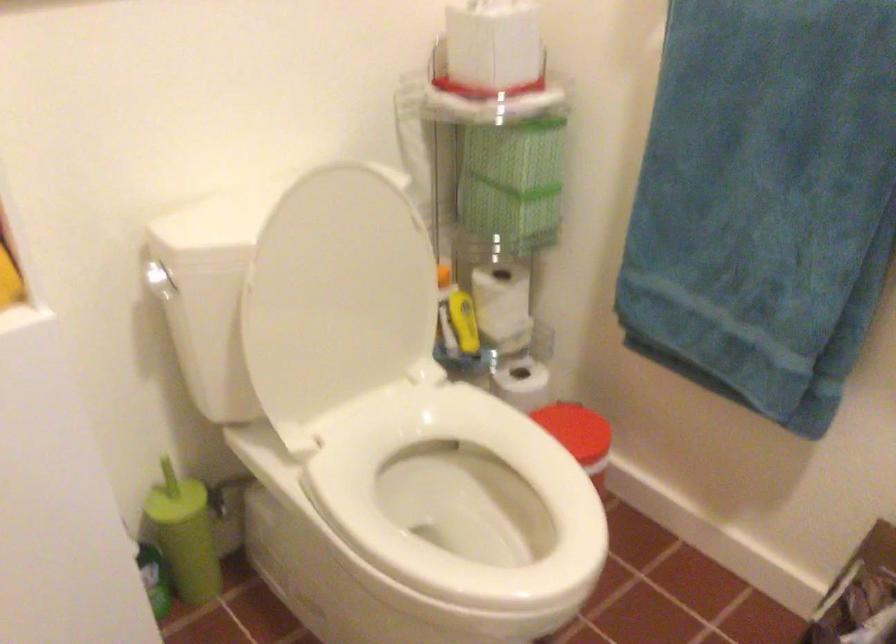
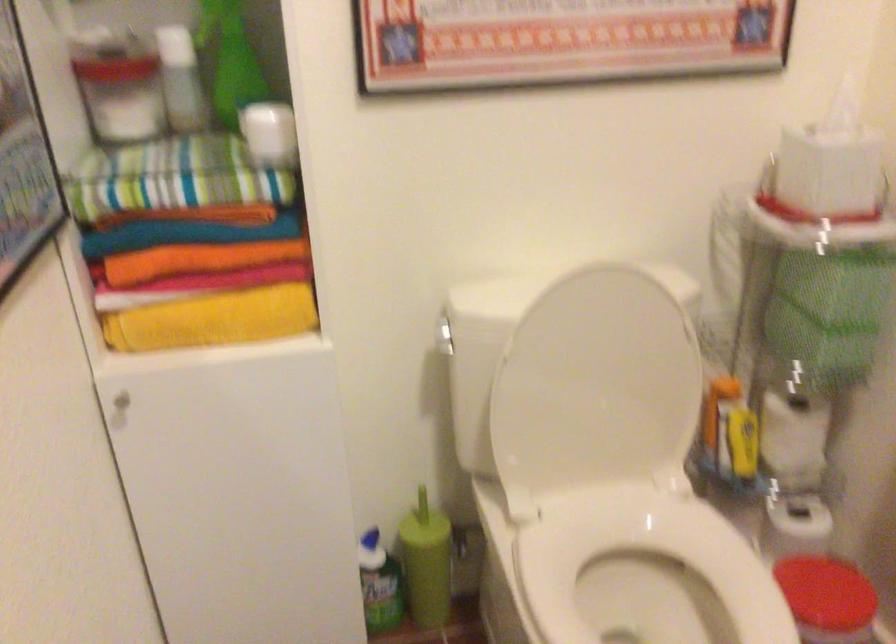
Find the pixel in the second image that matches [340,297] in the first image.

(595, 388)